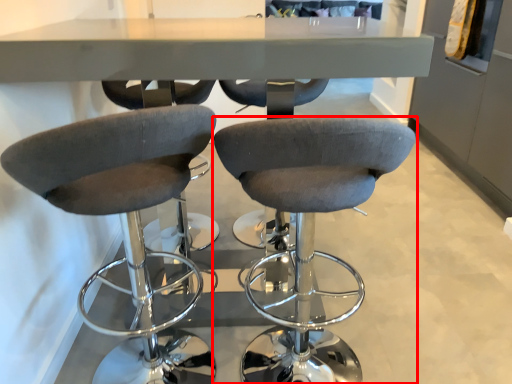
Question: From the image's perspective, where is chair (annotated by the red box) located relative to chair?

Choices:
 (A) below
 (B) above

Answer: (B)